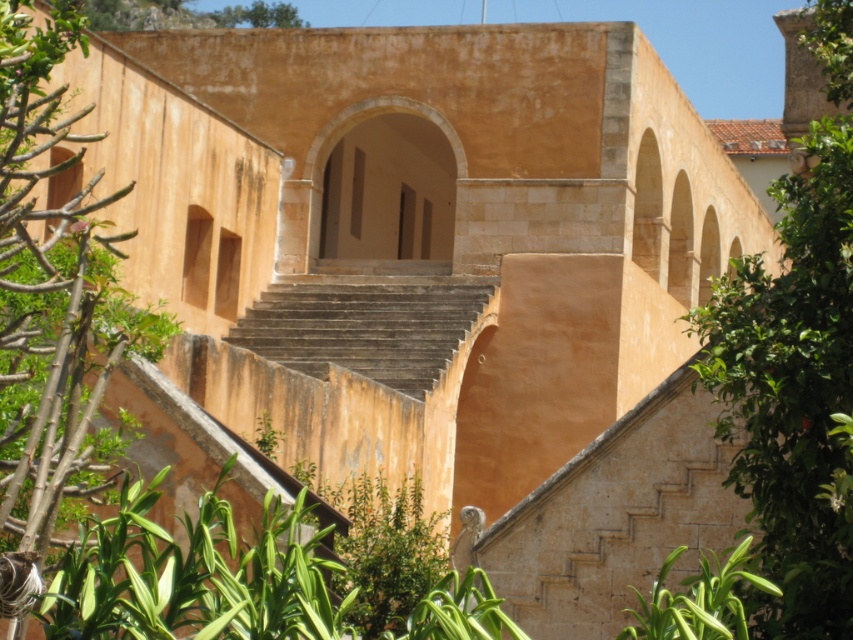
You are standing in front of the building and want to take a photo of the green leafy tree at right. Where should you position yourself to ensure the tree is centered in your camera frame?

To center the green leafy tree at right in your camera frame, position yourself directly in front of the building at the coordinates corresponding to point 0.613 on the horizontal axis and 0.931 on the vertical axis, as this is where the tree is located.

You are standing in front of the building and want to take a photo of the green leafy plant at lower right without the green leafy tree at left blocking the view. Is this possible?

The green leafy tree at left is in front of the green leafy plant at lower right, so you cannot take a photo of the green leafy plant at lower right without the tree blocking the view unless you move to a different angle or position where the tree is not in front.

From the picture: You are standing in front of the building and want to place a small decorative statue between the green leafy tree at left and the green leafy plant at lower right. Which object should you position the statue closer to if you want it to be visually balanced?

To achieve visual balance, position the statue closer to the green leafy plant at lower right since the green leafy tree at left is larger and would counterbalance it.